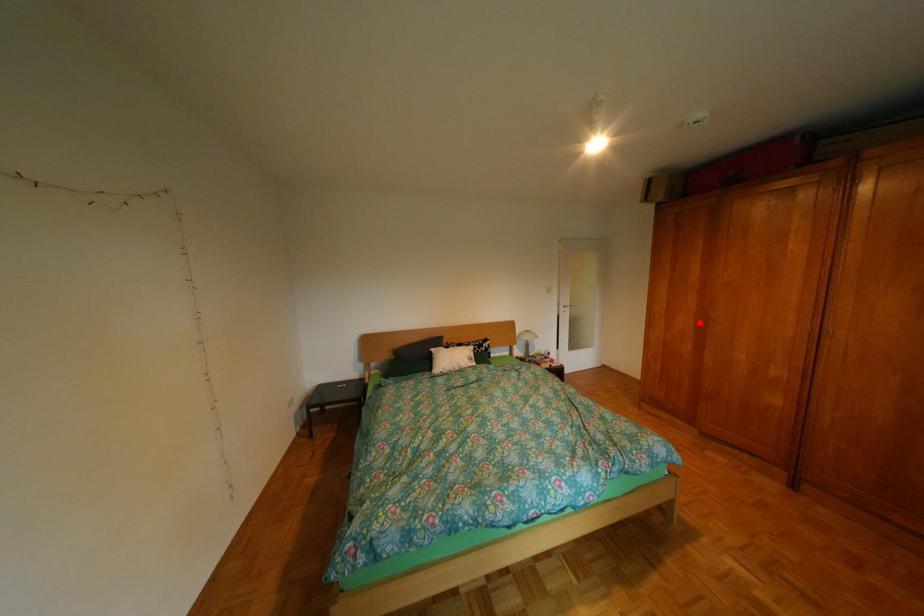
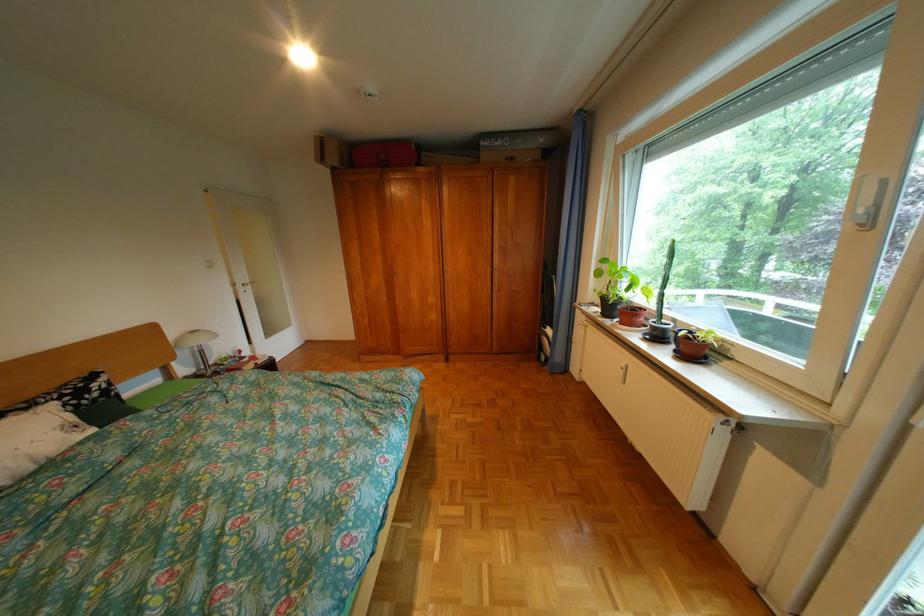
Where in the second image is the point corresponding to the highlighted location from the first image?

(392, 280)